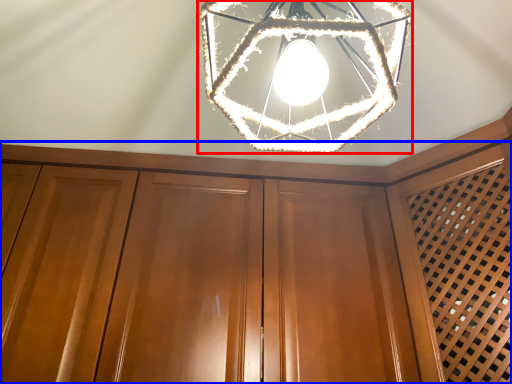
Question: Which object appears closest to the camera in this image, lamp (highlighted by a red box) or dresser (highlighted by a blue box)?

Choices:
 (A) lamp
 (B) dresser

Answer: (A)